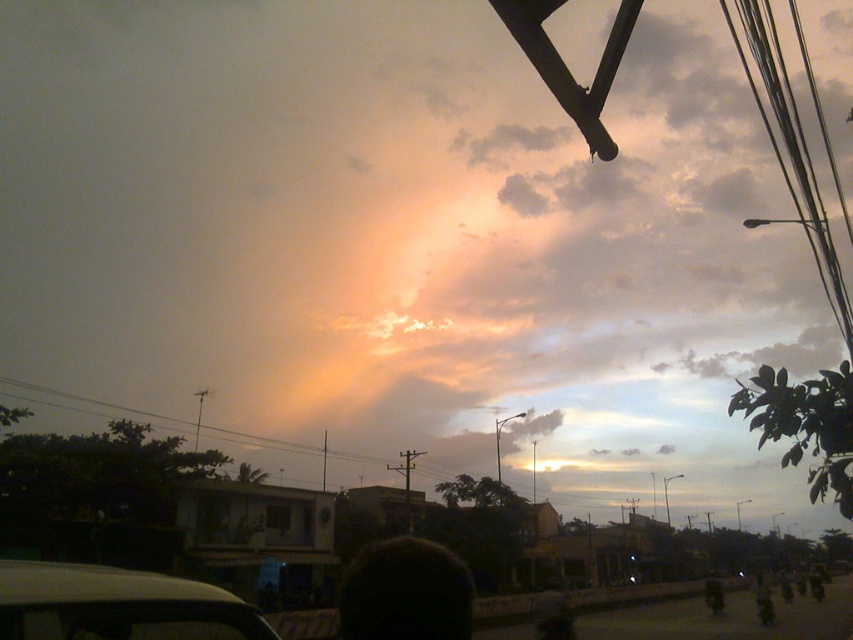
You are a photographer trying to capture the sunset reflected on the white matte car at lower left. Since the metallic wires at upper right might block the view, which object is taller and could potentially obstruct your shot?

The metallic wires at upper right are taller than the white matte car at lower left, so they could potentially obstruct the view of the sunset reflection on the car.

You are sitting in a car and looking out the window. You see a point at coordinates [117,605]. What object is located at that point?

The point at coordinates [117,605] corresponds to the white matte car at lower left.